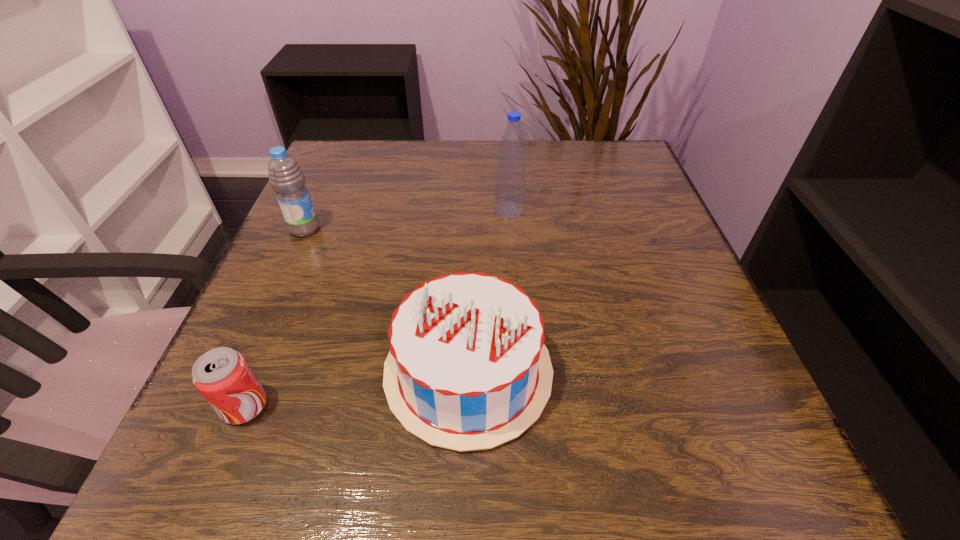
The width and height of the screenshot is (960, 540). I want to click on object that is at the near edge, so click(x=467, y=369).

The image size is (960, 540). Identify the location of water bottle that is at the left edge. (286, 178).

In order to click on soda can positioned at the left edge in this screenshot , I will do `click(222, 375)`.

Where is `vacant space at the far edge`? The height and width of the screenshot is (540, 960). vacant space at the far edge is located at coordinates (486, 144).

Locate an element on the screen. free region at the near edge is located at coordinates tap(374, 501).

Identify the location of vacant space at the left edge of the desktop. The width and height of the screenshot is (960, 540). (368, 196).

The image size is (960, 540). In the image, there is a desktop. What are the coordinates of `vacant space at the right edge` in the screenshot? It's located at (605, 260).

I want to click on vacant area at the far left corner, so click(x=346, y=174).

Locate an element on the screen. free space at the near left corner is located at coordinates (256, 455).

This screenshot has width=960, height=540. In the image, there is a desktop. Find the location of `vacant space at the far right corner`. vacant space at the far right corner is located at coordinates (600, 187).